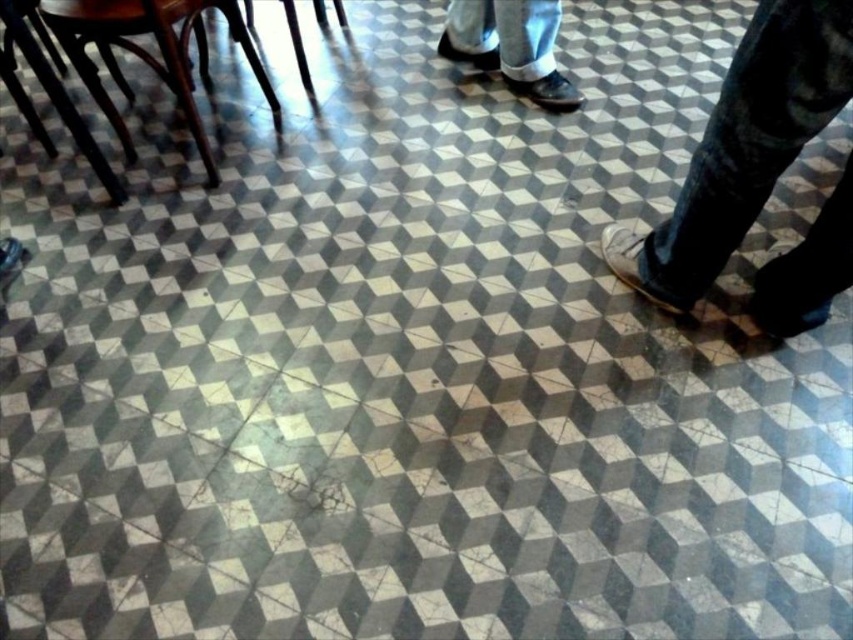
Who is lower down, brown leather shoe at lower right or matte black shoe at upper center?

brown leather shoe at lower right

Is brown leather shoe at lower right to the right of matte black shoe at upper center from the viewer's perspective?

Indeed, brown leather shoe at lower right is positioned on the right side of matte black shoe at upper center.

The width and height of the screenshot is (853, 640). What do you see at coordinates (743, 147) in the screenshot?
I see `brown leather shoe at lower right` at bounding box center [743, 147].

This screenshot has height=640, width=853. Identify the location of brown leather shoe at lower right. (743, 147).